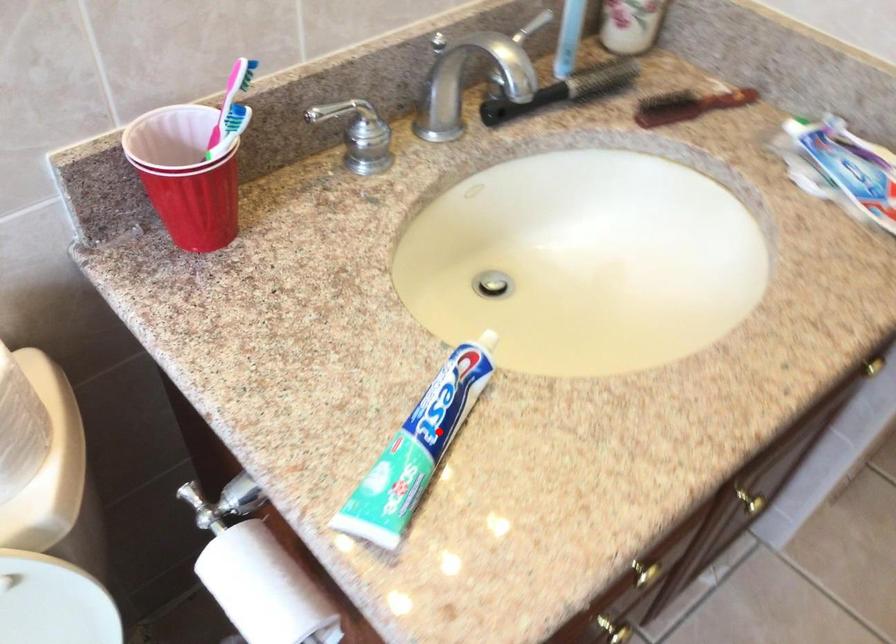
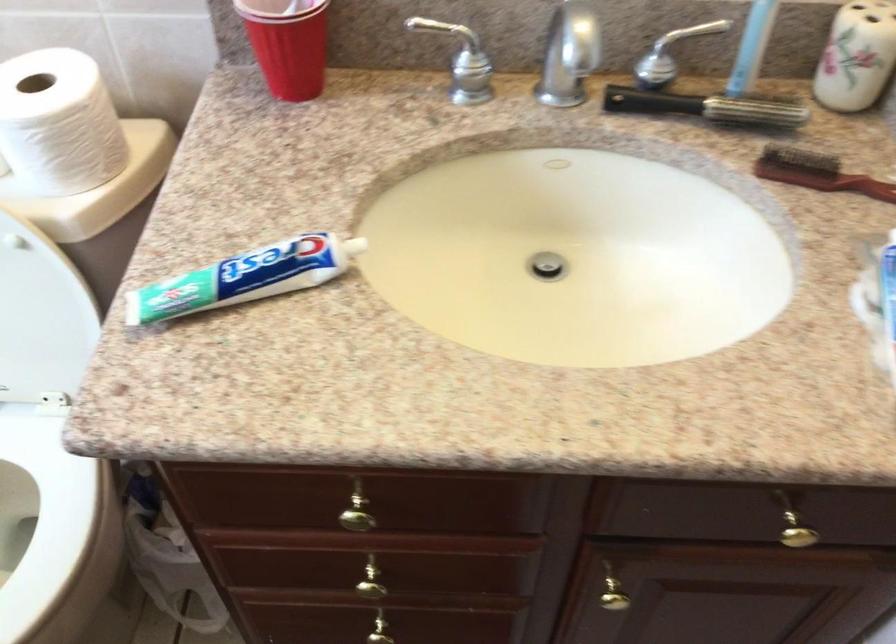
Question: I am providing you with two images of the same scene from different viewpoints. In image1, a red point is highlighted. Considering the same 3D point in image2, which of the following is correct?

Choices:
 (A) It is closer
 (B) It is farther

Answer: (B)